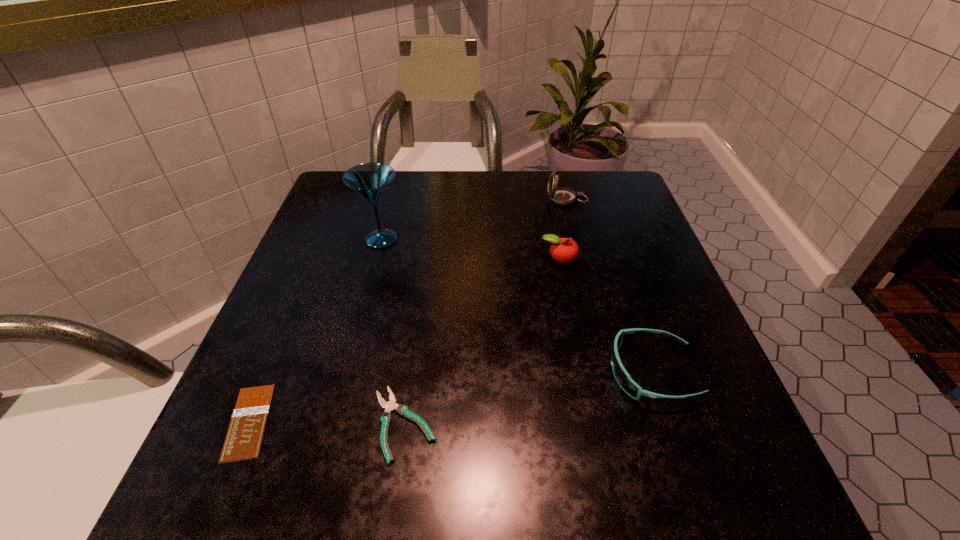
Find the location of a particular element. vacant space located 0.260m on the front of the martini is located at coordinates (352, 348).

Where is `vacant space located on the face of the fifth shortest object`? This screenshot has width=960, height=540. vacant space located on the face of the fifth shortest object is located at coordinates (442, 200).

Identify the location of vacant space located on the face of the fifth shortest object. coord(496,200).

The width and height of the screenshot is (960, 540). Identify the location of vacant area located on the face of the fifth shortest object. (504, 200).

At what (x,y) coordinates should I click in order to perform the action: click on vacant space located 0.300m on the front of the apple. Please return your answer as a coordinate pair (x, y). This screenshot has width=960, height=540. Looking at the image, I should click on (586, 389).

Identify the location of vacant space located on the front-facing side of the sunglasses. (384, 372).

Identify the location of blank area located on the front-facing side of the sunglasses. (508, 372).

Where is `blank space located on the front-facing side of the sunglasses`? blank space located on the front-facing side of the sunglasses is located at coordinates (378, 372).

At what (x,y) coordinates should I click in order to perform the action: click on vacant space located on the right of the fifth tallest object. Please return your answer as a coordinate pair (x, y). The height and width of the screenshot is (540, 960). Looking at the image, I should click on (691, 424).

Identify the location of free region located on the back of the shortest object. (301, 295).